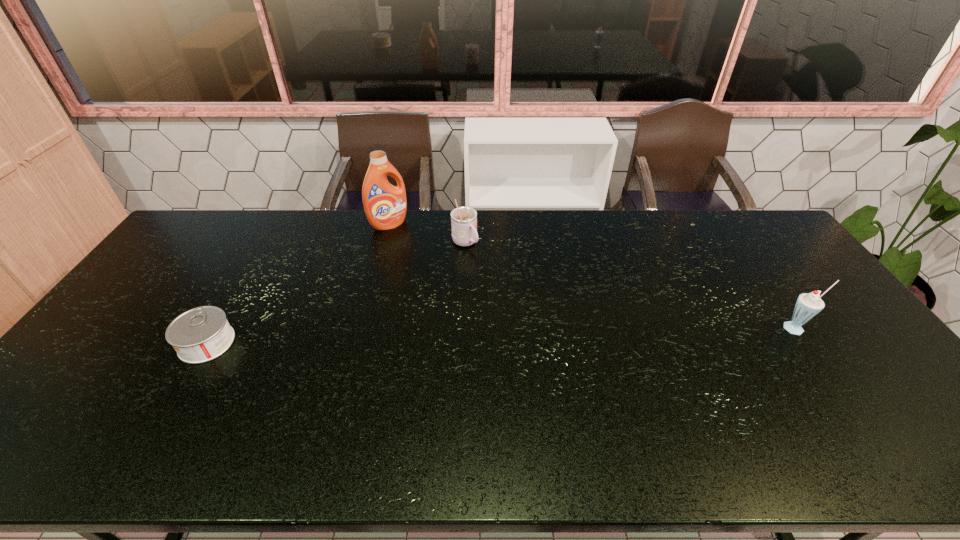
Where is `free region at the left edge of the desktop`? free region at the left edge of the desktop is located at coordinates (166, 294).

In the image, there is a desktop. At what (x,y) coordinates should I click in order to perform the action: click on free region at the right edge. Please return your answer as a coordinate pair (x, y). Looking at the image, I should click on (870, 383).

Where is `blank region between the farthest object and the cup`? The width and height of the screenshot is (960, 540). blank region between the farthest object and the cup is located at coordinates (427, 234).

You are a GUI agent. You are given a task and a screenshot of the screen. Output one action in this format:
    pyautogui.click(x=<x>, y=<y>)
    Task: Click on the free space between the milkshake and the detergent
    
    Given the screenshot: What is the action you would take?
    pyautogui.click(x=593, y=276)

This screenshot has height=540, width=960. I want to click on empty space that is in between the milkshake and the detergent, so click(593, 276).

Identify the location of vacant region between the second shortest object and the rightmost object. Image resolution: width=960 pixels, height=540 pixels. (631, 286).

In order to click on free spot between the third tallest object and the milkshake in this screenshot , I will do `click(631, 286)`.

Where is `empty location between the can and the milkshake`? empty location between the can and the milkshake is located at coordinates (502, 335).

Where is `free space between the can and the tallest object`? This screenshot has height=540, width=960. free space between the can and the tallest object is located at coordinates (298, 284).

The height and width of the screenshot is (540, 960). I want to click on free area in between the farthest object and the second shortest object, so click(427, 234).